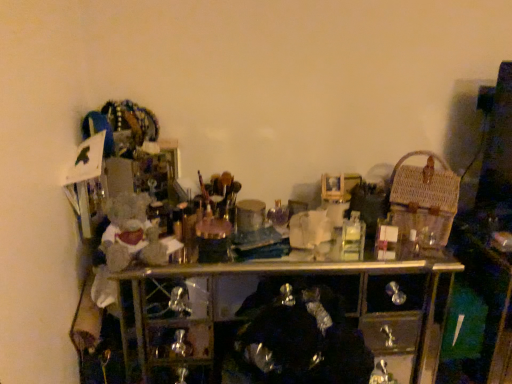
Measure the distance between woven brown basket at right and camera.

woven brown basket at right is 1.34 meters from camera.

Consider the image. In order to face woven brown basket at right, should I rotate leftwards or rightwards?

To face it directly, rotate right by 21.322 degrees.

The width and height of the screenshot is (512, 384). Describe the element at coordinates (424, 197) in the screenshot. I see `woven brown basket at right` at that location.

Identify the location of woven brown basket at right. The width and height of the screenshot is (512, 384). [x=424, y=197].

Locate an element on the screen. Image resolution: width=512 pixels, height=384 pixels. woven brown basket at right is located at coordinates (424, 197).